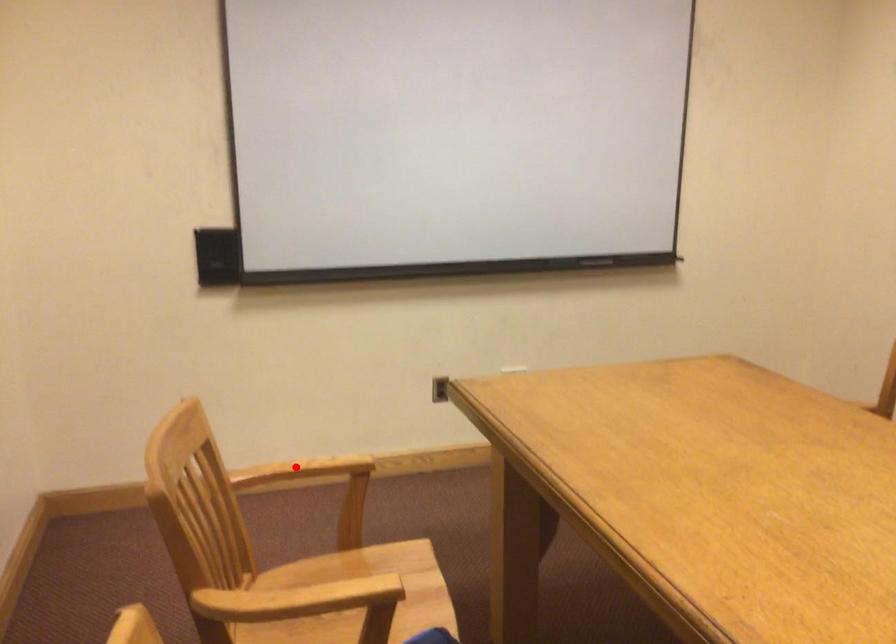
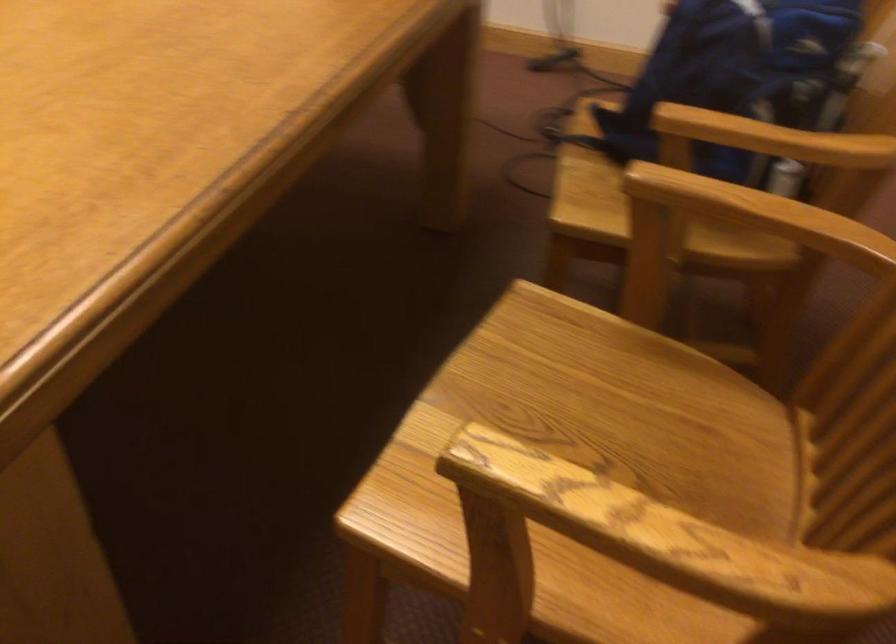
In the second image, find the point that corresponds to the highlighted location in the first image.

(658, 542)